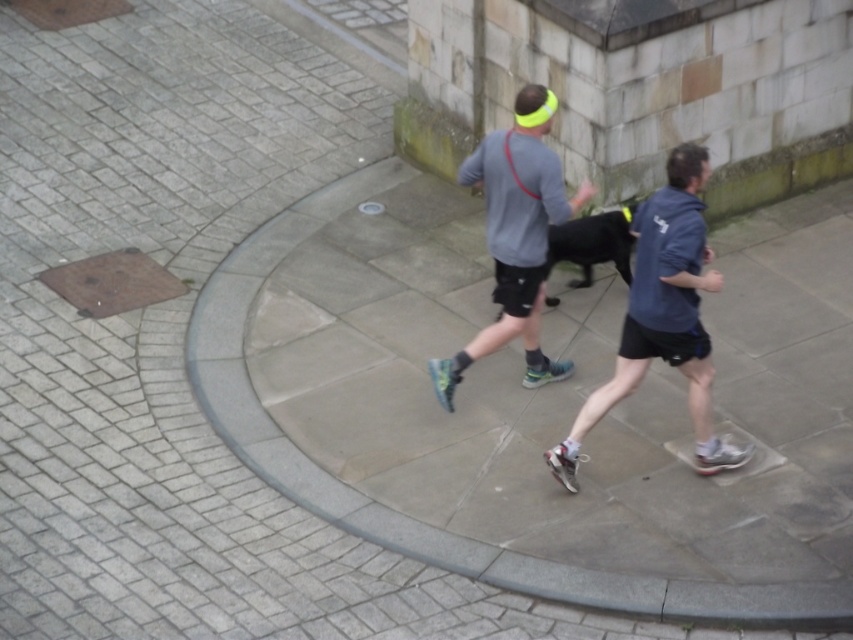
Can you confirm if blue fabric shirt at center is shorter than black smooth dog at center?

In fact, blue fabric shirt at center may be taller than black smooth dog at center.

Between point (650, 259) and point (608, 237), which one is positioned behind?

The point (608, 237) is more distant.

Image resolution: width=853 pixels, height=640 pixels. I want to click on blue fabric shirt at center, so click(663, 316).

Where is `blue fabric shirt at center`? The width and height of the screenshot is (853, 640). blue fabric shirt at center is located at coordinates (663, 316).

Can you confirm if blue fabric shirt at center is taller than gray matte shirt at center?

Correct, blue fabric shirt at center is much taller as gray matte shirt at center.

What are the coordinates of `blue fabric shirt at center` in the screenshot? It's located at (663, 316).

Where is `blue fabric shirt at center`? blue fabric shirt at center is located at coordinates (663, 316).

Can you confirm if gray matte shirt at center is positioned below black smooth dog at center?

Indeed, gray matte shirt at center is positioned under black smooth dog at center.

Does gray matte shirt at center have a lesser height compared to black smooth dog at center?

In fact, gray matte shirt at center may be taller than black smooth dog at center.

Between point (488, 148) and point (552, 248), which one is positioned behind?

The point (552, 248) is behind.

Image resolution: width=853 pixels, height=640 pixels. Find the location of `gray matte shirt at center`. gray matte shirt at center is located at coordinates tap(515, 236).